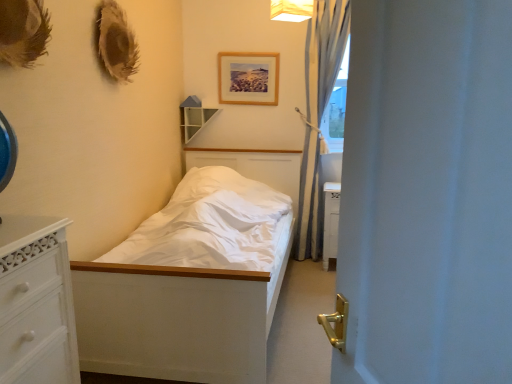
Question: From the image's perspective, is light blue sheer curtain at right above or below wooden picture frame at upper center?

Choices:
 (A) below
 (B) above

Answer: (A)

Question: In the image, is light blue sheer curtain at right positioned in front of or behind wooden picture frame at upper center?

Choices:
 (A) front
 (B) behind

Answer: (A)

Question: Which of these objects is positioned farthest from the light blue sheer curtain at right?

Choices:
 (A) white fabric lampshade at upper center
 (B) wooden picture frame at upper center
 (C) wooden shelf at upper center
 (D) white matte bed at center
 (E) white matte door at center

Answer: (E)

Question: Estimate the real-world distances between objects in this image. Which object is farther from the white fabric lampshade at upper center?

Choices:
 (A) wooden shelf at upper center
 (B) light blue sheer curtain at right
 (C) white matte bed at center
 (D) wooden picture frame at upper center
 (E) white matte door at center

Answer: (E)